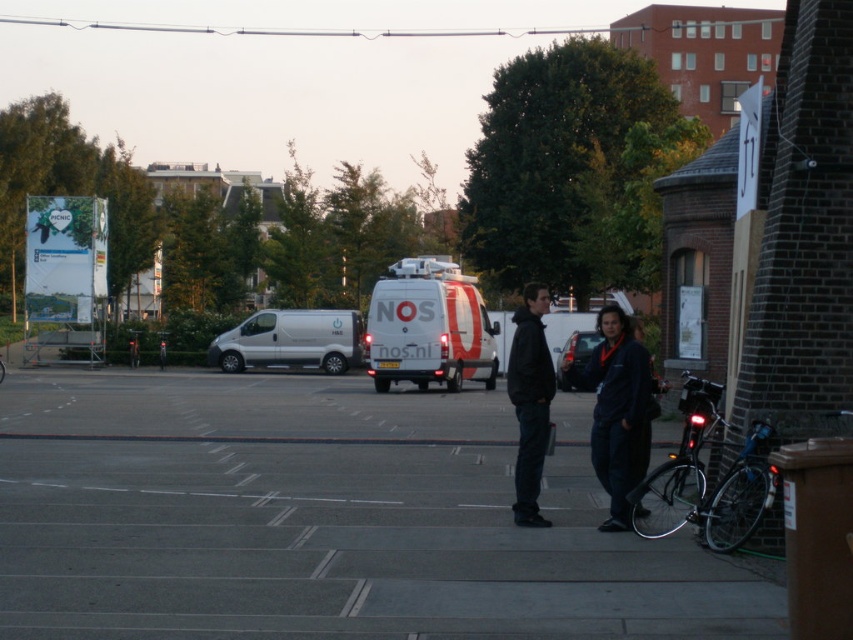
Question: Does silver metallic van at center have a lesser width compared to metallic silver van at center?

Choices:
 (A) no
 (B) yes

Answer: (A)

Question: Which is nearer to the dark blue jacket at center?

Choices:
 (A) metallic silver van at center
 (B) white glossy van at center

Answer: (A)

Question: Observing the image, what is the correct spatial positioning of dark blue jacket at center in reference to black matte jacket at center?

Choices:
 (A) right
 (B) left

Answer: (A)

Question: Does gray concrete parking lot at center have a greater width compared to black matte jacket at center?

Choices:
 (A) yes
 (B) no

Answer: (A)

Question: Which object is closer to the camera taking this photo?

Choices:
 (A) metallic silver van at center
 (B) gray concrete parking lot at center
 (C) dark blue jacket at center

Answer: (B)

Question: Among these points, which one is farthest from the camera?

Choices:
 (A) (381, 596)
 (B) (573, 342)
 (C) (283, 355)

Answer: (C)